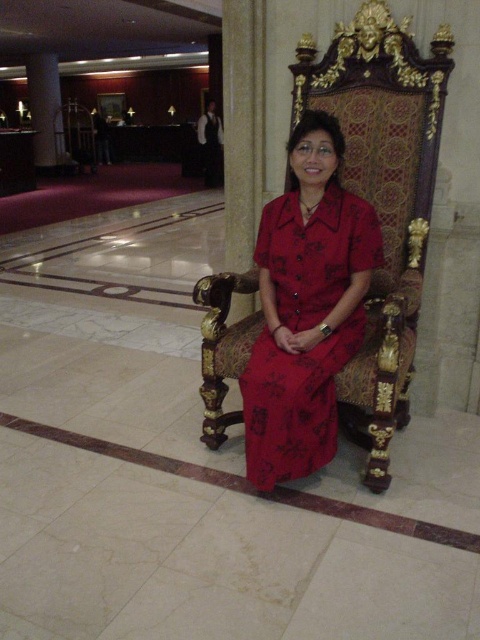
You are a photographer setting up for a shoot in a grand hall. You need to position a light source so that it illuminates the matte red dress at center without casting a shadow from the white marble pillar at upper left. Where should you place the light relative to the dress?

Since the matte red dress at center is located below the white marble pillar at upper left, you should position the light source above and behind the dress to avoid the pillar casting a shadow on it.

You are a photographer setting up for a photoshoot. You need to ensure that the matte red dress at center and the white marble pillar at upper left are both visible in the frame. Considering their sizes, which object should you focus on to ensure both are in focus?

The matte red dress at center is smaller than the white marble pillar at upper left. To ensure both are in focus, you should focus on the white marble pillar at upper left since it is larger and will be easier to frame while keeping the smaller matte red dress at center within the shot.